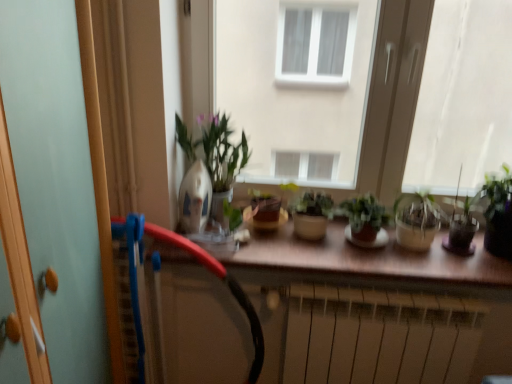
Question: Is light blue glass screen door at left oriented away from black rubber garden hose at center?

Choices:
 (A) yes
 (B) no

Answer: (B)

Question: Is black rubber garden hose at center completely or partially inside light blue glass screen door at left?

Choices:
 (A) no
 (B) yes

Answer: (A)

Question: Does light blue glass screen door at left lie in front of black rubber garden hose at center?

Choices:
 (A) no
 (B) yes

Answer: (B)

Question: Does light blue glass screen door at left have a lesser height compared to black rubber garden hose at center?

Choices:
 (A) no
 (B) yes

Answer: (A)

Question: Would you consider light blue glass screen door at left to be distant from black rubber garden hose at center?

Choices:
 (A) yes
 (B) no

Answer: (B)

Question: Can you confirm if light blue glass screen door at left is taller than black rubber garden hose at center?

Choices:
 (A) no
 (B) yes

Answer: (B)

Question: Is translucent glass pot at right, the 2th houseplant from the right, at the back of brown matte counter top at center?

Choices:
 (A) yes
 (B) no

Answer: (B)

Question: Is brown matte counter top at center at the right side of translucent glass pot at right, the 2th houseplant from the right?

Choices:
 (A) yes
 (B) no

Answer: (B)

Question: Does brown matte counter top at center have a lesser width compared to translucent glass pot at right, the third houseplant when ordered from left to right?

Choices:
 (A) no
 (B) yes

Answer: (A)

Question: Can you confirm if brown matte counter top at center is wider than translucent glass pot at right, the 2th houseplant from the right?

Choices:
 (A) yes
 (B) no

Answer: (A)

Question: Is brown matte counter top at center positioned far away from translucent glass pot at right, the third houseplant when ordered from left to right?

Choices:
 (A) yes
 (B) no

Answer: (B)

Question: From a real-world perspective, does brown matte counter top at center stand above translucent glass pot at right, the third houseplant when ordered from left to right?

Choices:
 (A) yes
 (B) no

Answer: (B)

Question: Can we say transparent glass window at right, arranged as the 1th window when viewed from the right, lies outside translucent glass pot at right, the third houseplant when ordered from left to right?

Choices:
 (A) yes
 (B) no

Answer: (A)